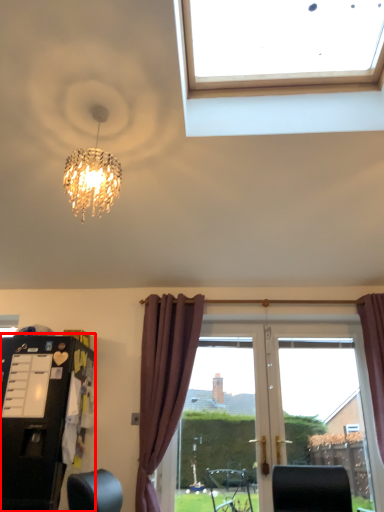
Question: From the image's perspective, considering the relative positions of dresser (annotated by the red box) and curtain in the image provided, where is dresser (annotated by the red box) located with respect to the staircase?

Choices:
 (A) above
 (B) below

Answer: (B)